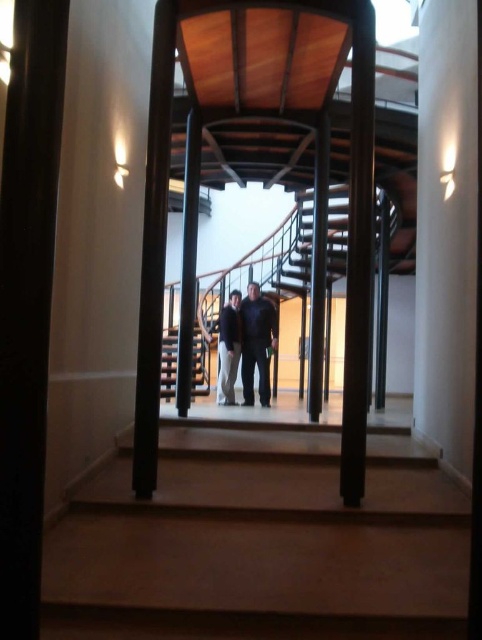
You are standing in the modern architectural interior with the spiral staircase. You see two points marked in the scene. Which point is closer to you, point (x=76, y=499) or point (x=221, y=324)?

Point (x=76, y=499) is closer to the viewer than point (x=221, y=324).

You are standing in the main area of the room and want to walk towards the spiral staircase. There are two points marked in the scene, point (249, 321) and point (166, 400). Which point should you aim for to reach the staircase first?

You should aim for point (249, 321) because it is in front of point (166, 400), meaning it is closer to the staircase.

You are a painter who needs to determine which object at center requires a taller ladder to reach its top. Based on the scene, which object should you choose between the wooden stairs at center and the wooden at center?

The wooden at center is taller than the wooden stairs at center, so you should choose the wooden at center to reach its top with a taller ladder.